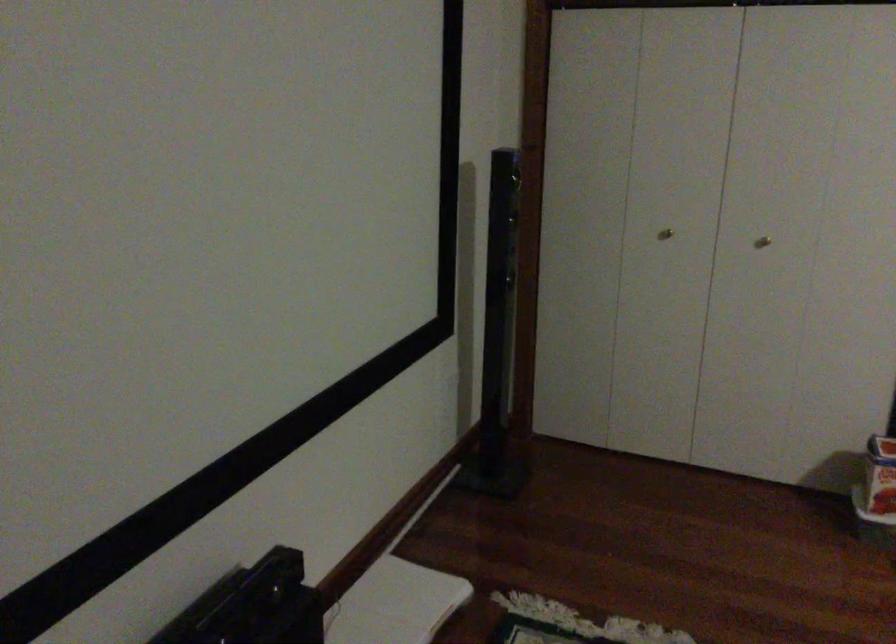
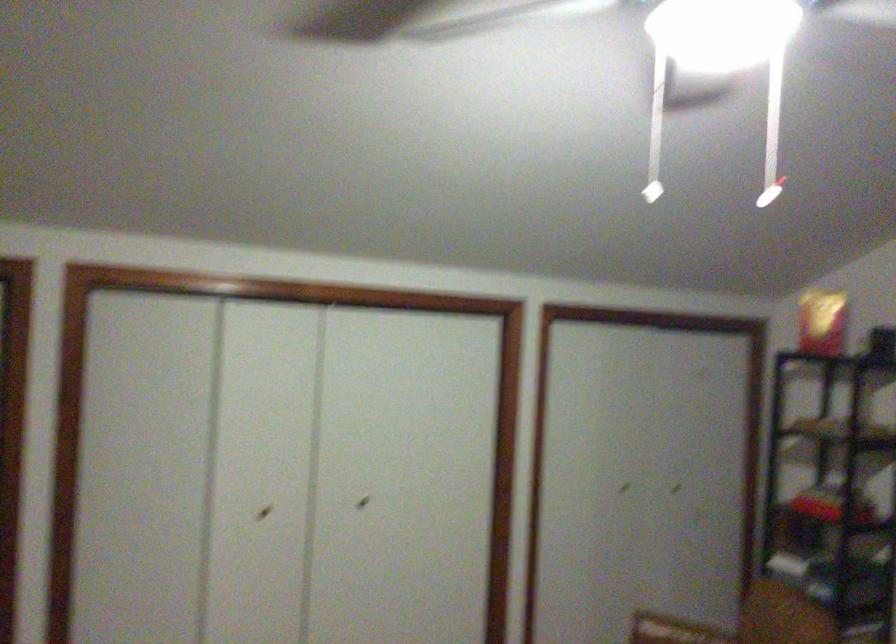
Question: The camera is either moving clockwise (left) or counter-clockwise (right) around the object. The first image is from the beginning of the video and the second image is from the end. Is the camera moving left or right when shooting the video?

Choices:
 (A) Left
 (B) Right

Answer: (A)